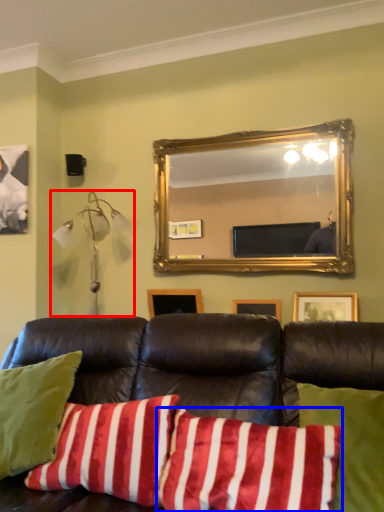
Question: Which of the following is the closest to the observer, lamp (highlighted by a red box) or pillow (highlighted by a blue box)?

Choices:
 (A) lamp
 (B) pillow

Answer: (B)